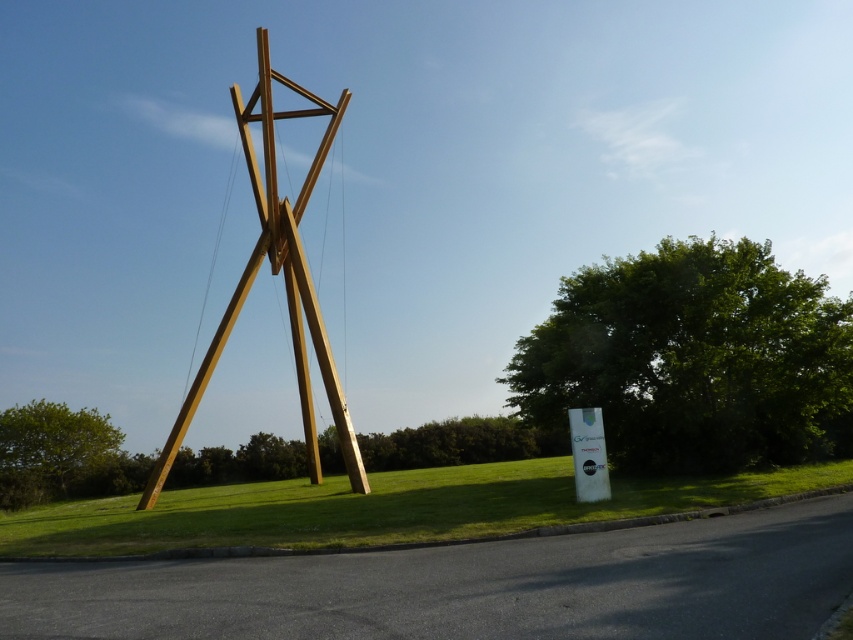
Question: Based on their relative distances, which object is farther from the natural wood sculpture at center?

Choices:
 (A) green grass at center
 (B) green leafy tree at lower left
 (C) white glossy sign at lower right

Answer: (C)

Question: Which of the following is the farthest from the observer?

Choices:
 (A) green leafy tree at lower left
 (B) white glossy sign at lower right
 (C) green leafy tree at center
 (D) natural wood sculpture at center

Answer: (A)

Question: Which of the following is the closest to the observer?

Choices:
 (A) white glossy sign at lower right
 (B) green leafy tree at center
 (C) green leafy tree at lower left
 (D) natural wood sculpture at center

Answer: (A)

Question: Is the position of natural wood sculpture at center more distant than that of green leafy tree at lower left?

Choices:
 (A) yes
 (B) no

Answer: (B)

Question: Does natural wood sculpture at center have a larger size compared to white glossy sign at lower right?

Choices:
 (A) no
 (B) yes

Answer: (B)

Question: Can you confirm if green leafy tree at center is positioned to the right of green grass at center?

Choices:
 (A) yes
 (B) no

Answer: (A)